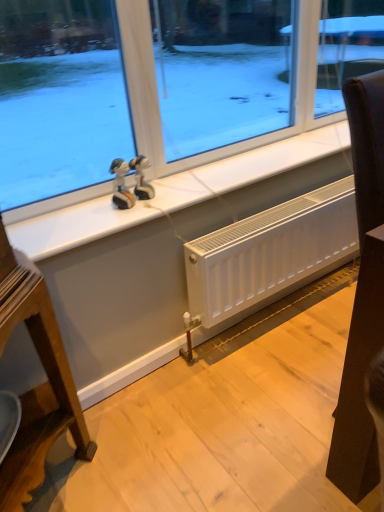
Where is `free space behind black leather chair at right`? The width and height of the screenshot is (384, 512). free space behind black leather chair at right is located at coordinates (319, 335).